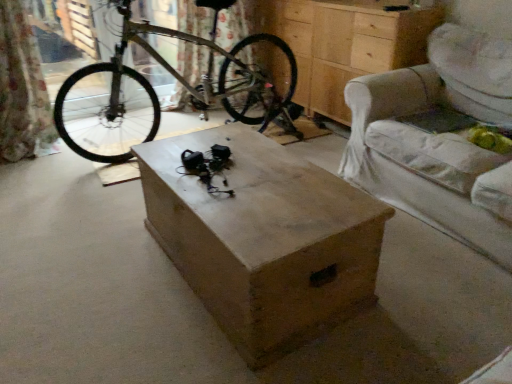
In order to click on vacant area that is situated to the right of wooden box at center in this screenshot , I will do `click(426, 289)`.